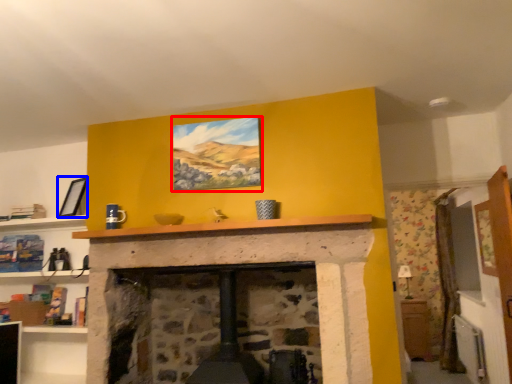
Question: Which of the following is the closest to the observer, picture frame (highlighted by a red box) or picture frame (highlighted by a blue box)?

Choices:
 (A) picture frame
 (B) picture frame

Answer: (A)